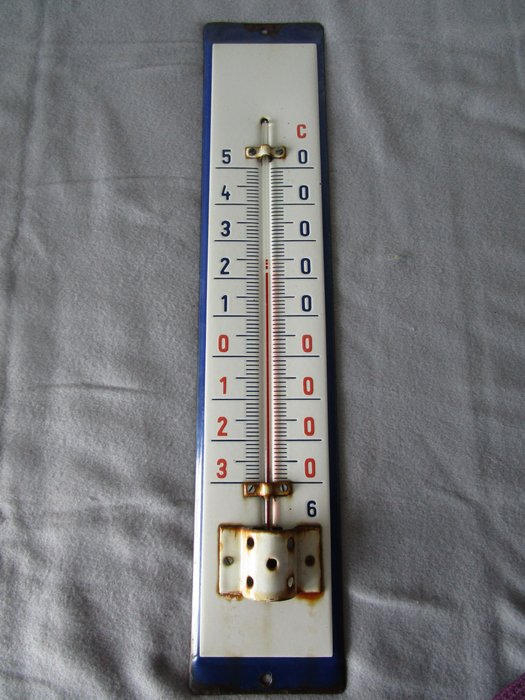
Find the location of `cloth`. cloth is located at coordinates (50, 666).